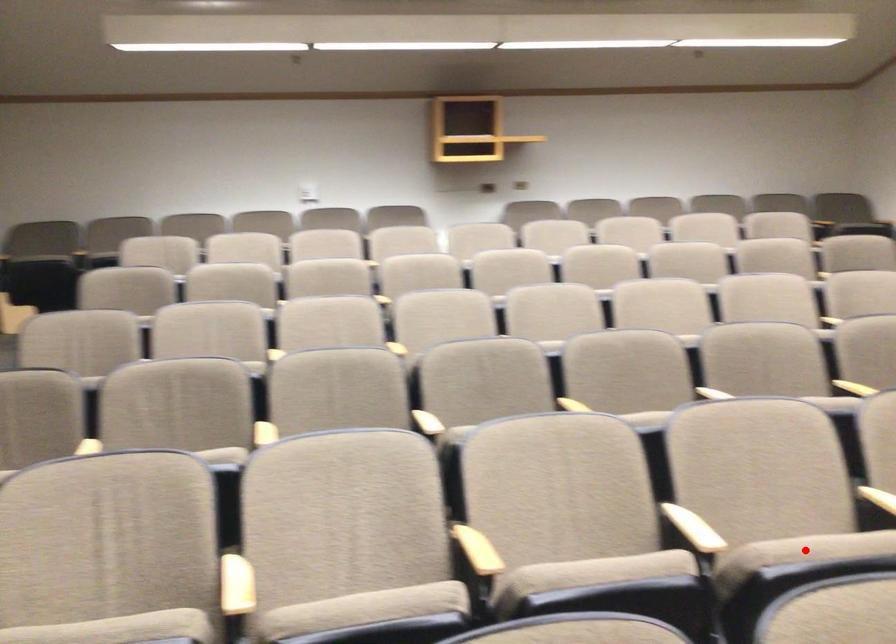
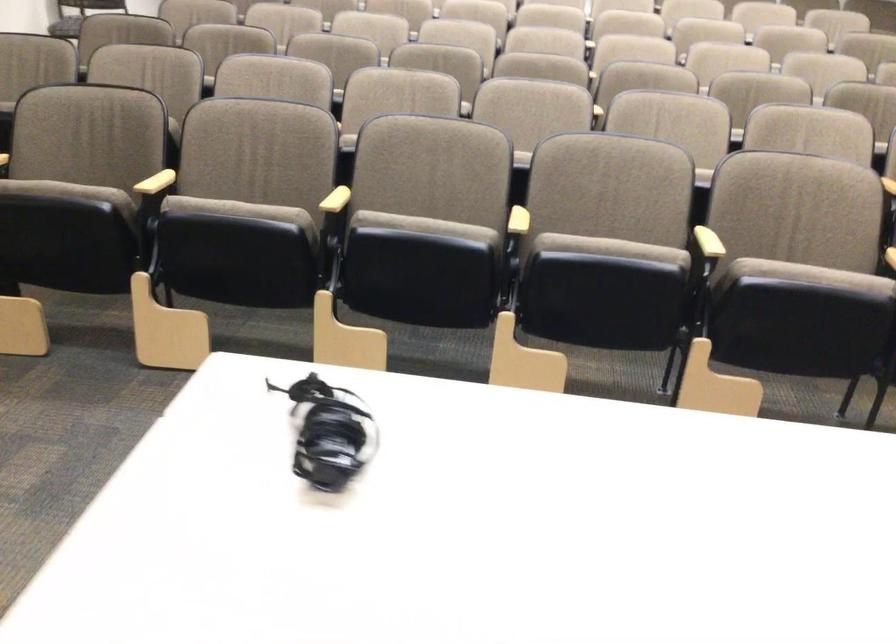
Question: I am providing you with two images of the same scene from different viewpoints. A red point is marked on the first image. Is the red point's position out of view in image 2?

Choices:
 (A) Yes
 (B) No

Answer: (A)